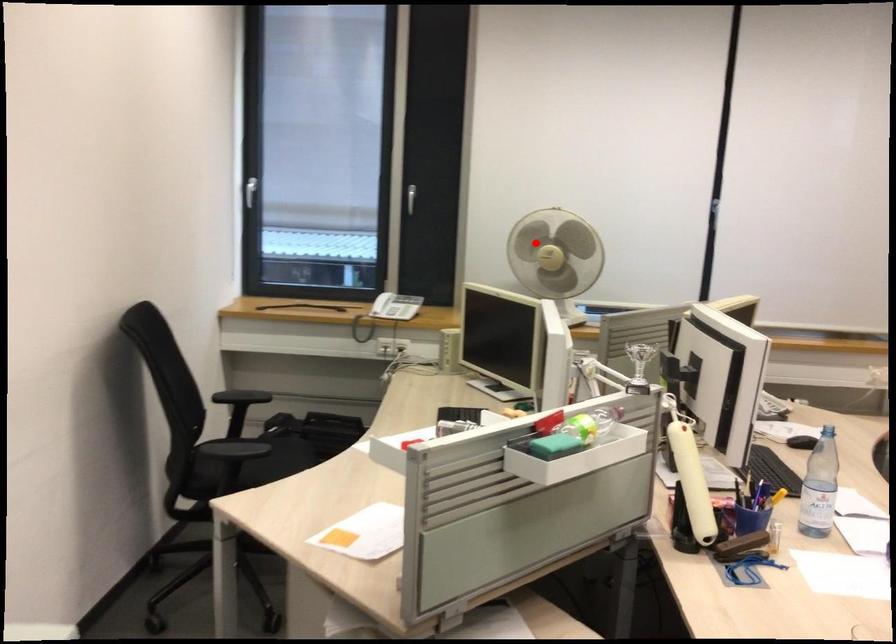
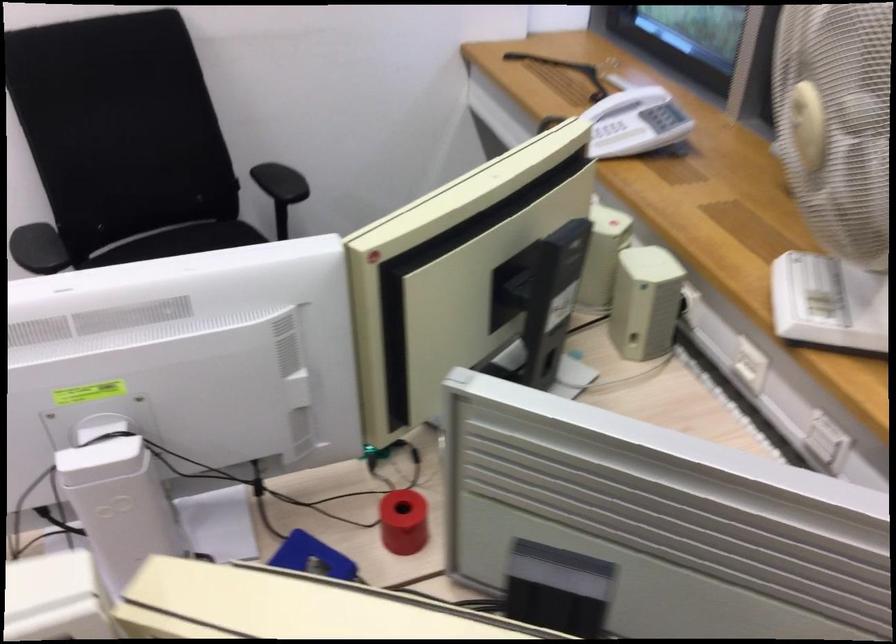
In the second image, find the point that corresponds to the highlighted location in the first image.

(807, 125)